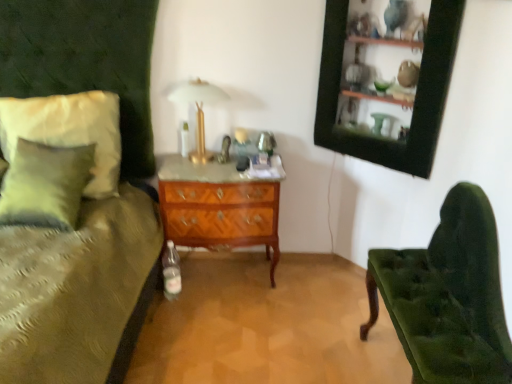
Find the location of `vacant space in front of woodenwoodenchest of drawers at center`. vacant space in front of woodenwoodenchest of drawers at center is located at coordinates (222, 327).